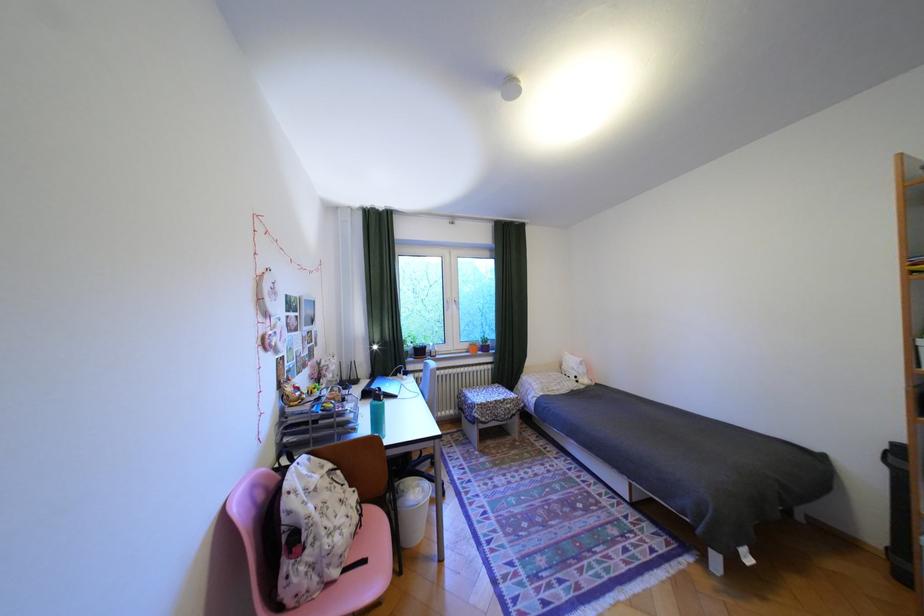
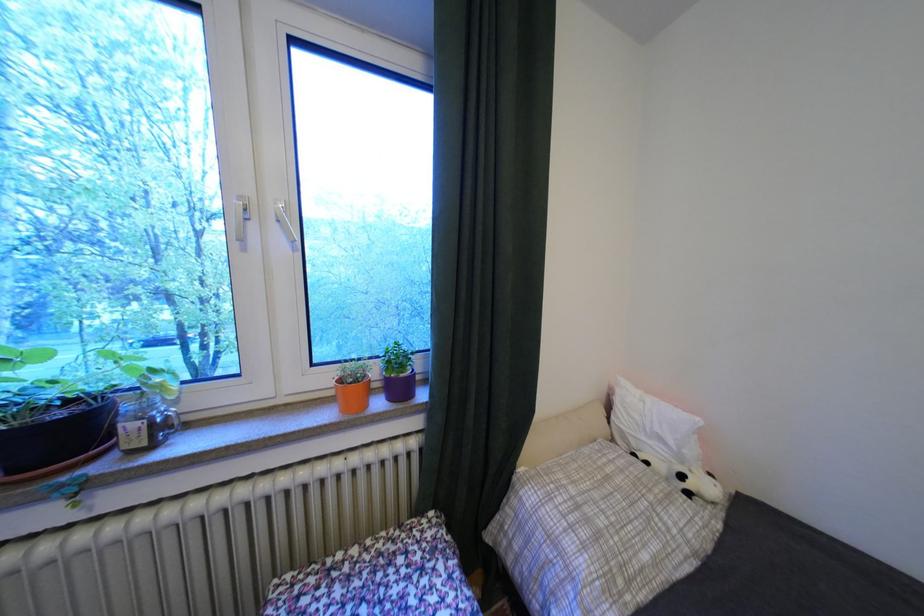
Question: Which direction would the cameraman need to move to produce the second image? Reply with the corresponding letter.

Choices:
 (A) Left
 (B) Right
 (C) Forward
 (D) Backward

Answer: (C)